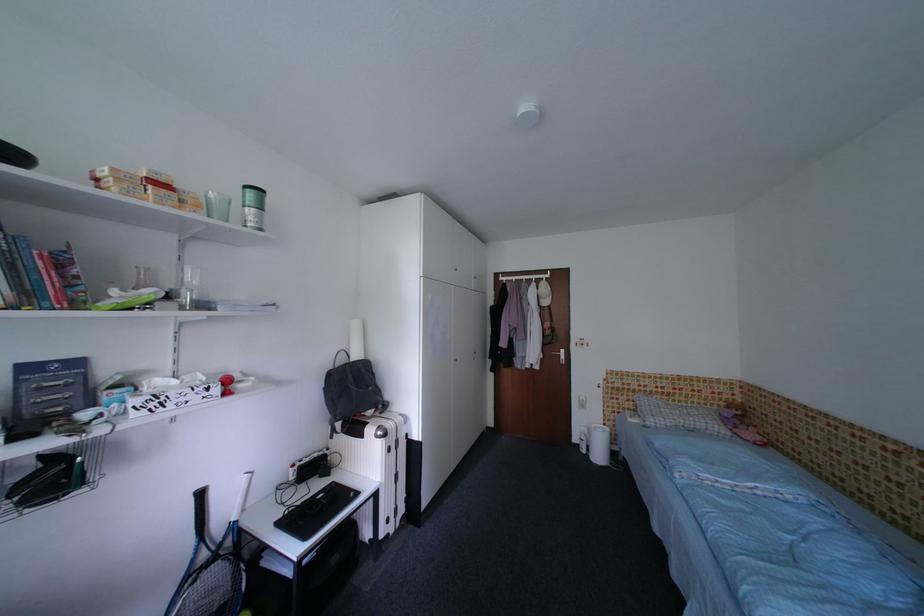
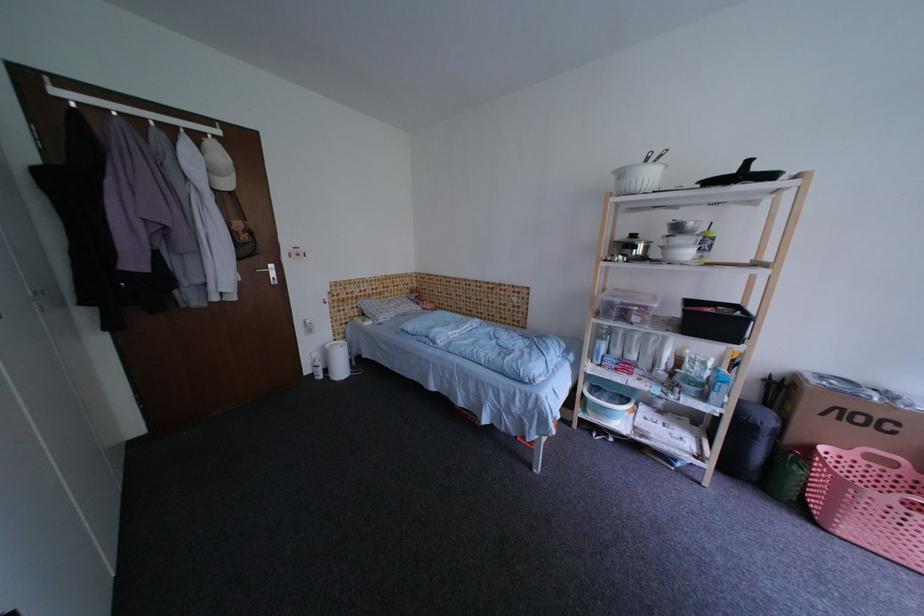
How did the camera likely rotate?

The camera's rotation is toward right-down.